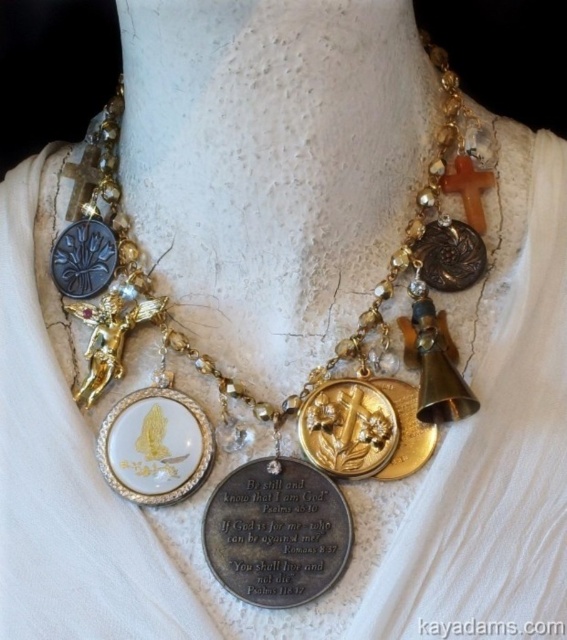
Question: Where is gold metallic medallions at center located in relation to wooden cross at upper right in the image?

Choices:
 (A) left
 (B) right

Answer: (A)

Question: Can you confirm if silver metallic plaque at center is positioned to the left of wooden cross at upper right?

Choices:
 (A) yes
 (B) no

Answer: (A)

Question: Among these points, which one is nearest to the camera?

Choices:
 (A) (375, 321)
 (B) (472, 236)
 (C) (467, 173)

Answer: (A)

Question: Which point is farther to the camera?

Choices:
 (A) silver metallic plaque at center
 (B) gold metallic medallions at center
 (C) gold textured medallion at center
 (D) wooden cross at upper right

Answer: (D)

Question: Does gold textured cross at center have a greater width compared to gold textured medallion at center?

Choices:
 (A) no
 (B) yes

Answer: (B)

Question: Among these objects, which one is farthest from the camera?

Choices:
 (A) wooden cross at upper right
 (B) silver metallic plaque at center

Answer: (A)